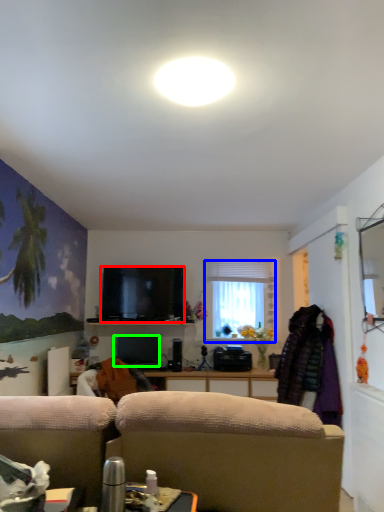
Question: Based on their relative distances, which object is farther from television (highlighted by a red box)? Choose from window (highlighted by a blue box) and television (highlighted by a green box).

Choices:
 (A) window
 (B) television

Answer: (A)